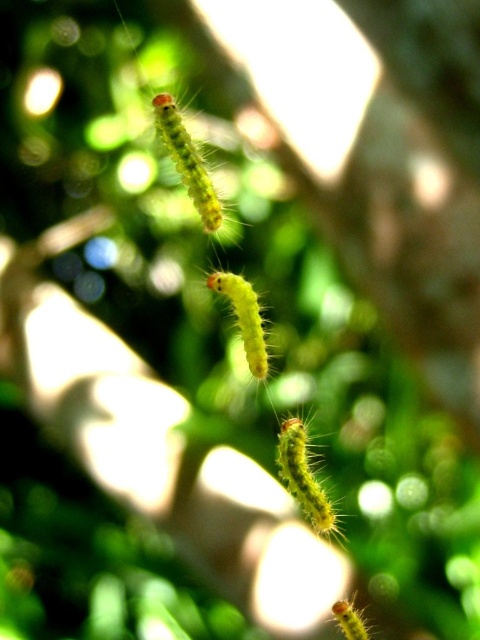
Does fuzzy yellow caterpillar at center have a larger size compared to fuzzy yellow caterpillar at lower right?

Correct, fuzzy yellow caterpillar at center is larger in size than fuzzy yellow caterpillar at lower right.

Is fuzzy yellow caterpillar at center shorter than fuzzy yellow caterpillar at lower right?

No, fuzzy yellow caterpillar at center is not shorter than fuzzy yellow caterpillar at lower right.

Which is in front, point (287, 429) or point (336, 620)?

Positioned in front is point (336, 620).

Where is `fuzzy yellow caterpillar at center`? This screenshot has height=640, width=480. fuzzy yellow caterpillar at center is located at coordinates (303, 477).

Is fuzzy yellow caterpillar at upper center wider than fuzzy yellow caterpillar at lower right?

Yes, fuzzy yellow caterpillar at upper center is wider than fuzzy yellow caterpillar at lower right.

The height and width of the screenshot is (640, 480). What do you see at coordinates (192, 170) in the screenshot?
I see `fuzzy yellow caterpillar at upper center` at bounding box center [192, 170].

What do you see at coordinates (192, 170) in the screenshot? I see `fuzzy yellow caterpillar at upper center` at bounding box center [192, 170].

The width and height of the screenshot is (480, 640). I want to click on fuzzy yellow caterpillar at upper center, so click(192, 170).

Does fuzzy yellow caterpillar at center come in front of yellow fuzzy caterpillar at center?

Yes, it is in front of yellow fuzzy caterpillar at center.

Is fuzzy yellow caterpillar at center to the right of yellow fuzzy caterpillar at center from the viewer's perspective?

Indeed, fuzzy yellow caterpillar at center is positioned on the right side of yellow fuzzy caterpillar at center.

Which is in front, point (304, 504) or point (256, 353)?

Point (304, 504) is more forward.

You are a GUI agent. You are given a task and a screenshot of the screen. Output one action in this format:
    pyautogui.click(x=<x>, y=<y>)
    Task: Click on the fuzzy yellow caterpillar at center
    
    Given the screenshot: What is the action you would take?
    pyautogui.click(x=303, y=477)